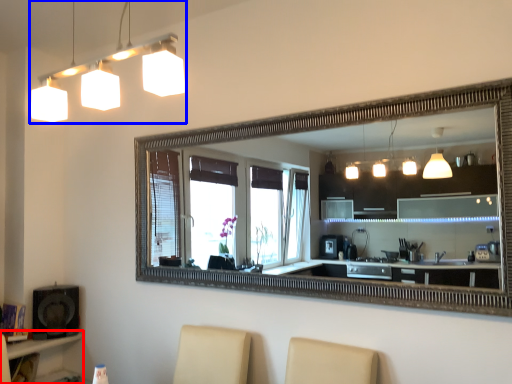
Question: Which object is further to the camera taking this photo, vanity (highlighted by a red box) or lamp (highlighted by a blue box)?

Choices:
 (A) vanity
 (B) lamp

Answer: (A)